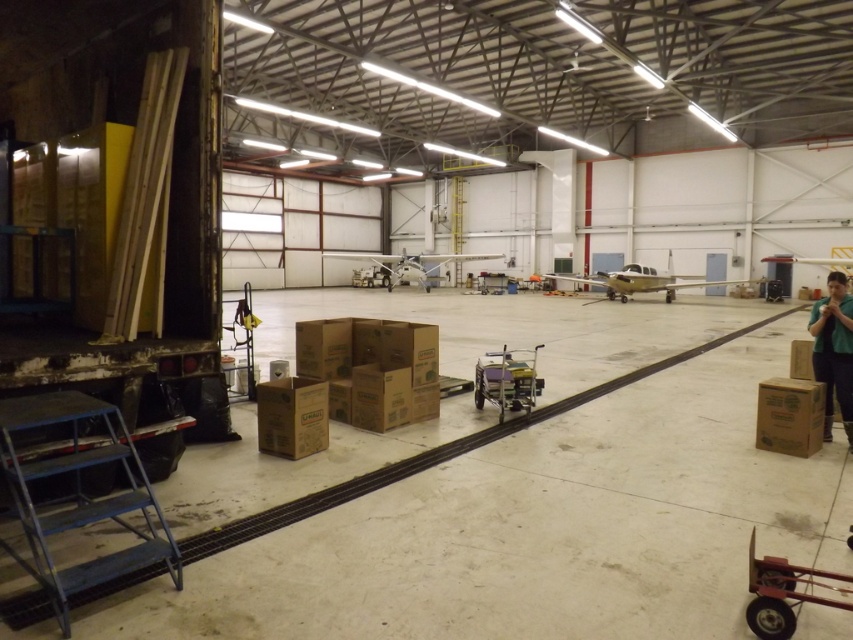
Question: Which object is closer to the camera taking this photo?

Choices:
 (A) brown cardboard box at lower right
 (B) metallic red handcart at lower right

Answer: (B)

Question: Observing the image, what is the correct spatial positioning of green fabric shirt at right in reference to metallic silver cart at center?

Choices:
 (A) left
 (B) right

Answer: (B)

Question: Is brown cardboard box at center above brown cardboard box at lower right?

Choices:
 (A) no
 (B) yes

Answer: (B)

Question: Which of the following is the farthest from the observer?

Choices:
 (A) (772, 577)
 (B) (315, 408)
 (C) (792, 412)
 (D) (846, 419)

Answer: (D)

Question: Which object is farther from the camera taking this photo?

Choices:
 (A) metallic red handcart at lower right
 (B) brown cardboard box at center

Answer: (B)

Question: Does metallic red handcart at lower right have a lesser width compared to green fabric shirt at right?

Choices:
 (A) no
 (B) yes

Answer: (A)